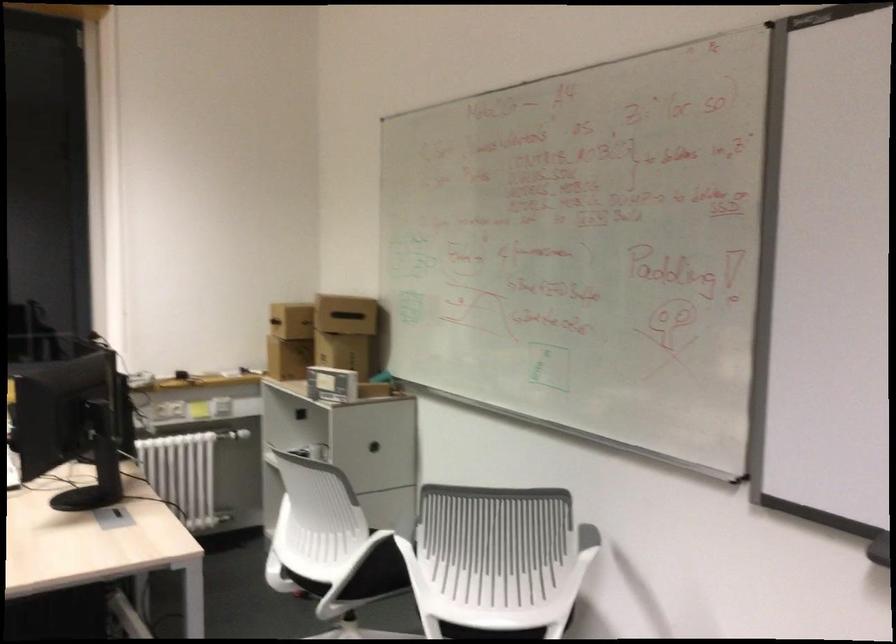
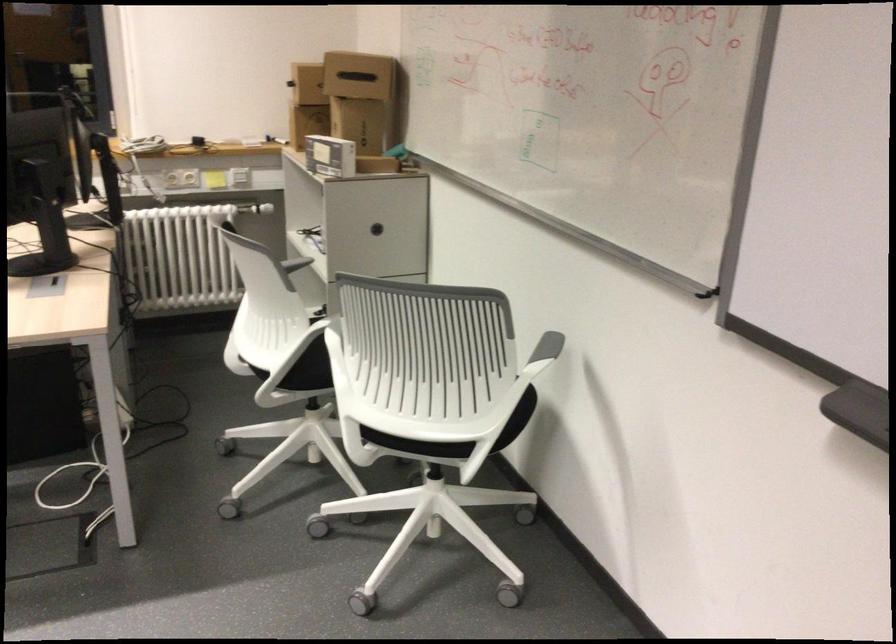
The point at (x=343, y=313) is marked in the first image. Where is the corresponding point in the second image?

(358, 75)